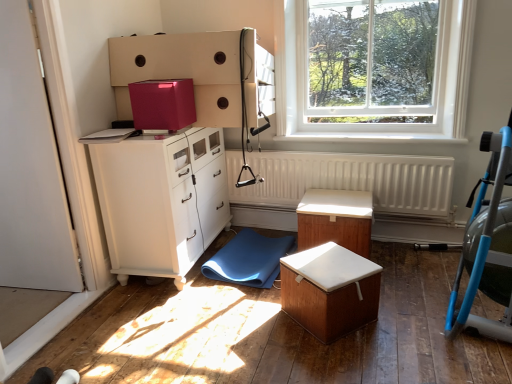
At what (x,y) coordinates should I click in order to perform the action: click on free space to the left of wooden box with white cushion at center, marked as the first table in a front-to-back arrangement. Please return your answer as a coordinate pair (x, y). Looking at the image, I should click on click(x=257, y=327).